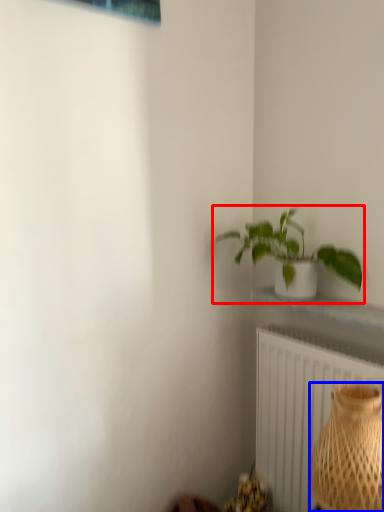
Question: Which object is closer to the camera taking this photo, houseplant (highlighted by a red box) or vase (highlighted by a blue box)?

Choices:
 (A) houseplant
 (B) vase

Answer: (B)